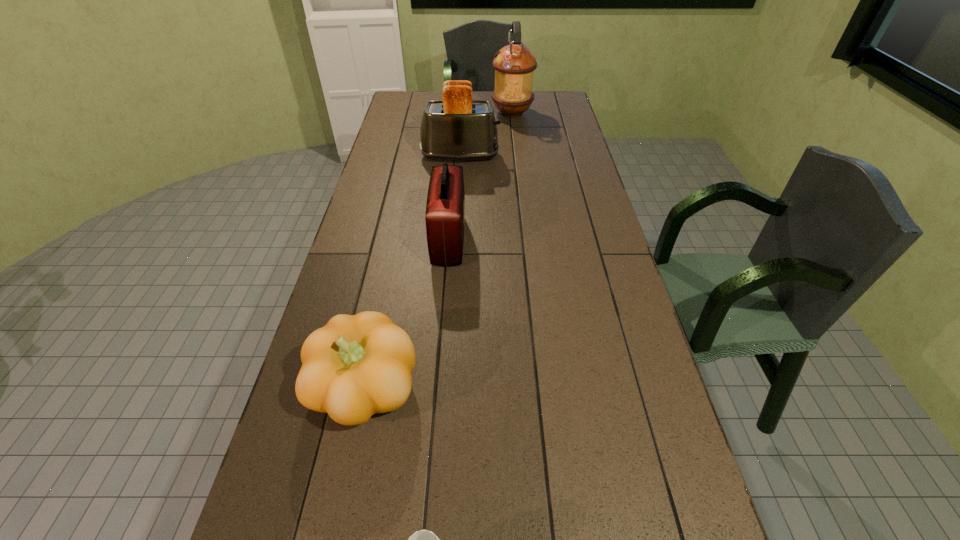
At what (x,y) coordinates should I click in order to perform the action: click on the farthest object. Please return your answer as a coordinate pair (x, y). Looking at the image, I should click on (514, 64).

This screenshot has width=960, height=540. I want to click on oil lamp, so click(x=514, y=64).

This screenshot has width=960, height=540. Identify the location of the fourth nearest object. (457, 128).

The image size is (960, 540). I want to click on toaster, so click(x=457, y=128).

The width and height of the screenshot is (960, 540). In order to click on the first aid kit in this screenshot , I will do `click(445, 209)`.

Where is `the third shortest object`? the third shortest object is located at coordinates (445, 209).

Image resolution: width=960 pixels, height=540 pixels. In order to click on the second nearest object in this screenshot , I will do `click(355, 366)`.

Where is `pumpkin`? pumpkin is located at coordinates (355, 366).

Find the location of `vacant space situated on the back of the farthest object`. vacant space situated on the back of the farthest object is located at coordinates 510,96.

Where is `vacant area located 0.340m on the side of the toaster with the control lever`? The width and height of the screenshot is (960, 540). vacant area located 0.340m on the side of the toaster with the control lever is located at coordinates (584, 156).